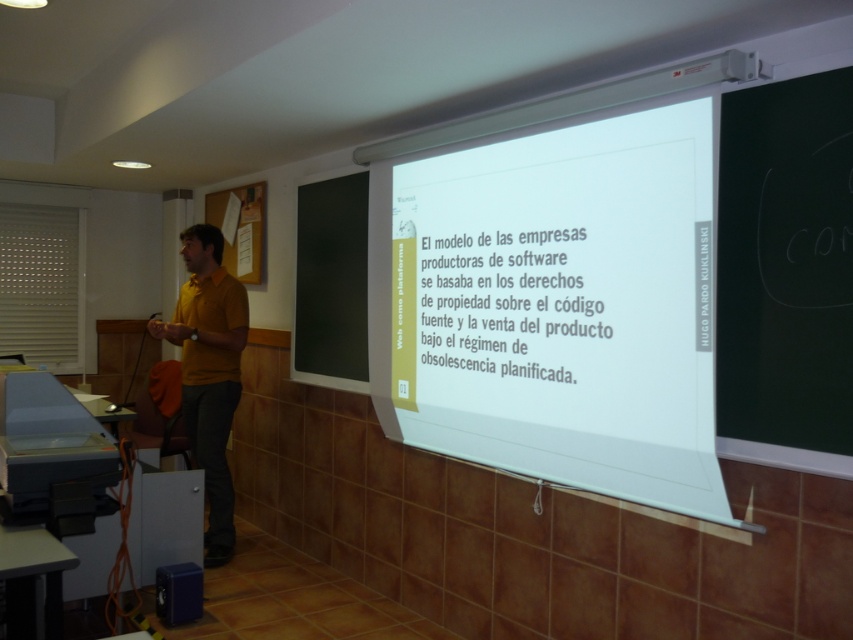
You are a student in the classroom and need to write a note. You see the black chalkboard at right and the white paper at center. Which one is closer to the left side of the room?

The white paper at center is closer to the left side of the room because the black chalkboard at right is to the right of it.